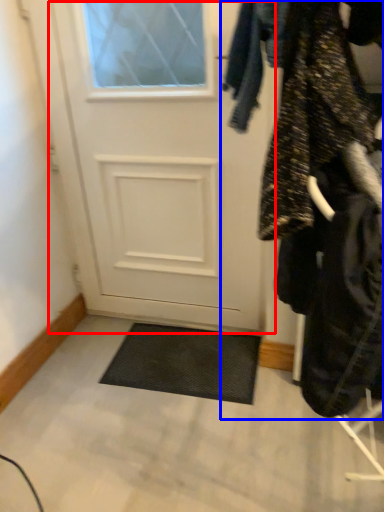
Question: Among these objects, which one is nearest to the camera, door (highlighted by a red box) or closet (highlighted by a blue box)?

Choices:
 (A) door
 (B) closet

Answer: (B)